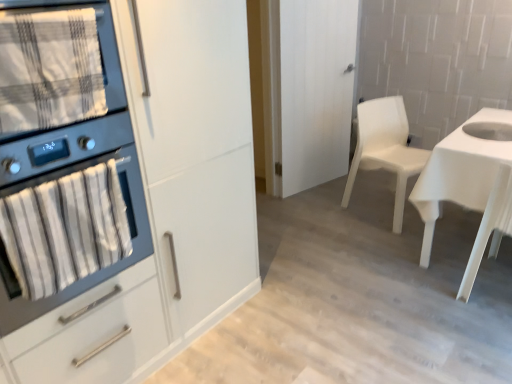
Where is `free location above plaid fabric towel at left (from a real-world perspective)`? free location above plaid fabric towel at left (from a real-world perspective) is located at coordinates click(34, 14).